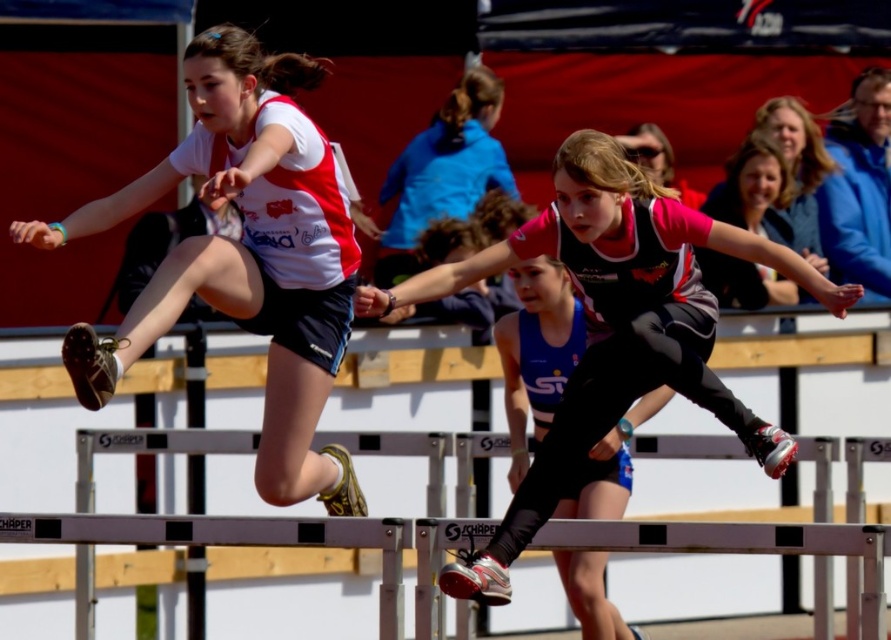
You are a photographer at the track event. You need to capture a photo of the athlete wearing white matte shorts at left and matte black shorts at center. From which side should you position yourself to ensure both athletes are visible in the frame?

You should position yourself to the right side of the athletes because the white matte shorts at left is to the left of matte black shorts at center, so positioning to the right would allow both to be in the frame without obstruction.